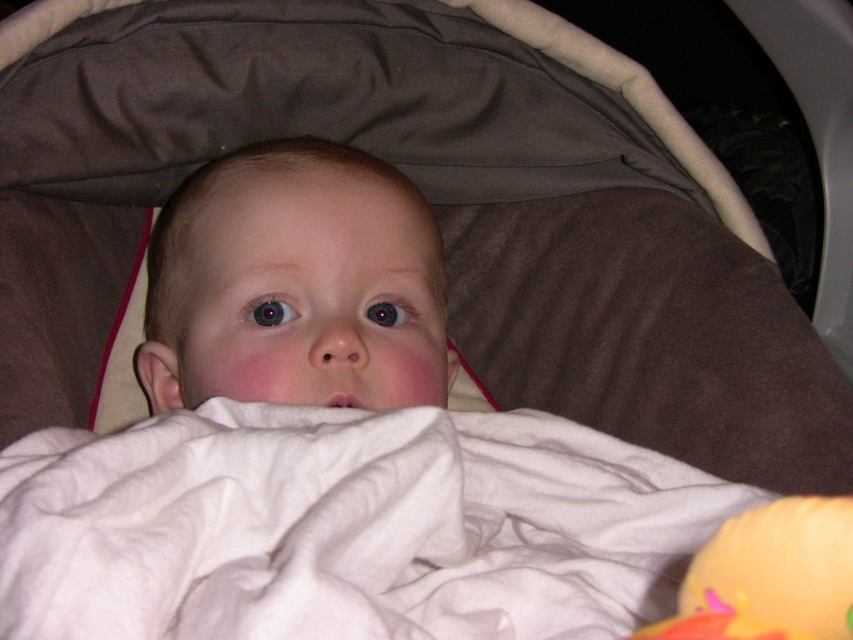
Who is lower down, white soft blanket at center or orange rubber duck at lower right?

orange rubber duck at lower right is lower down.

Does point (317, 433) come closer to viewer compared to point (848, 632)?

No, (317, 433) is behind (848, 632).

Is point (553, 493) closer to viewer compared to point (770, 630)?

No, (553, 493) is further to viewer.

This screenshot has width=853, height=640. Find the location of `white soft blanket at center`. white soft blanket at center is located at coordinates (346, 528).